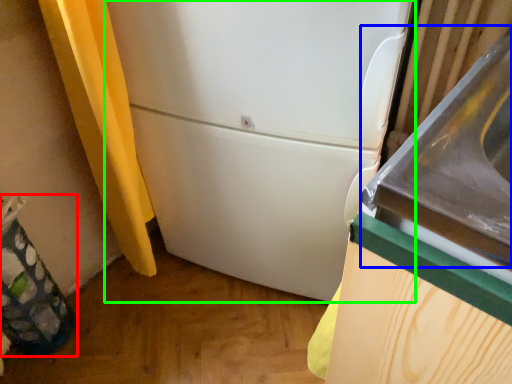
Question: Which is farther away from garbage (highlighted by a red box)? sink (highlighted by a blue box) or refrigerator (highlighted by a green box)?

Choices:
 (A) sink
 (B) refrigerator

Answer: (A)